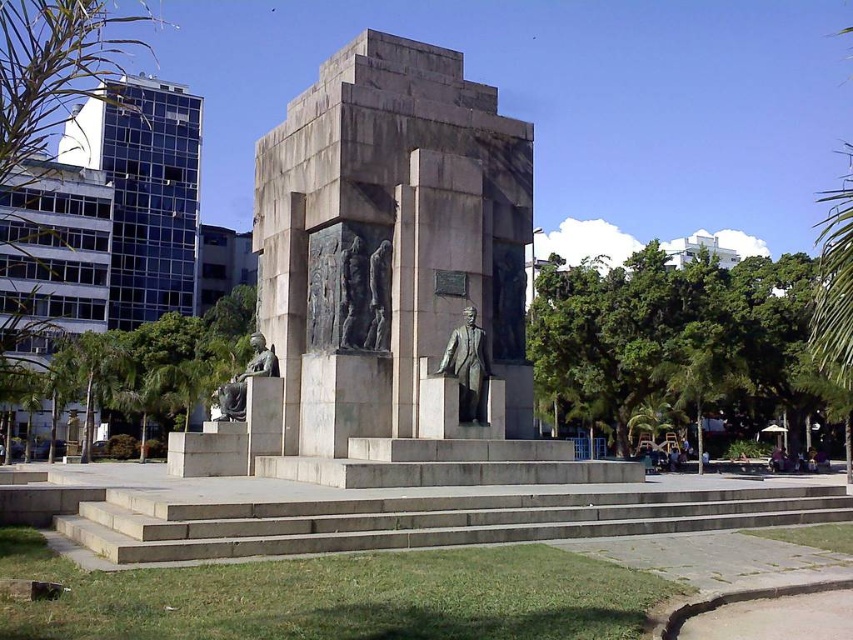
Does bronze sculpture at center have a lesser width compared to gray concrete stairs at center?

Correct, bronze sculpture at center's width is less than gray concrete stairs at center's.

Identify the location of bronze sculpture at center. This screenshot has width=853, height=640. (380, 257).

Between gray concrete stairs at center and bronze statue at center, which one is positioned higher?

bronze statue at center

Is point (486, 492) in front of point (474, 410)?

Yes, point (486, 492) is closer to viewer.

Where is `gray concrete stairs at center`? This screenshot has width=853, height=640. gray concrete stairs at center is located at coordinates (422, 516).

Who is taller, gray concrete stairs at center or green leafy palm tree at right?

green leafy palm tree at right is taller.

Can you confirm if gray concrete stairs at center is taller than green leafy palm tree at right?

No, gray concrete stairs at center is not taller than green leafy palm tree at right.

Between point (108, 497) and point (717, 364), which one is positioned in front?

Point (108, 497) is more forward.

This screenshot has width=853, height=640. In order to click on gray concrete stairs at center in this screenshot , I will do `click(422, 516)`.